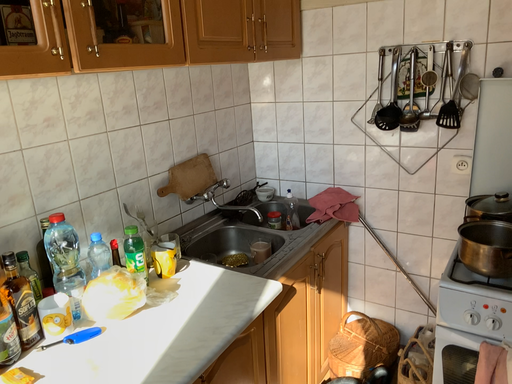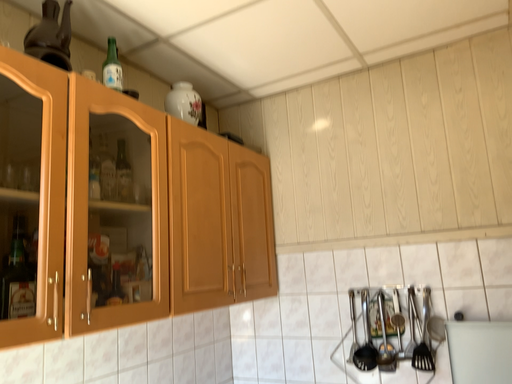
Question: Which way did the camera rotate in the video?

Choices:
 (A) rotated downward
 (B) rotated upward

Answer: (B)